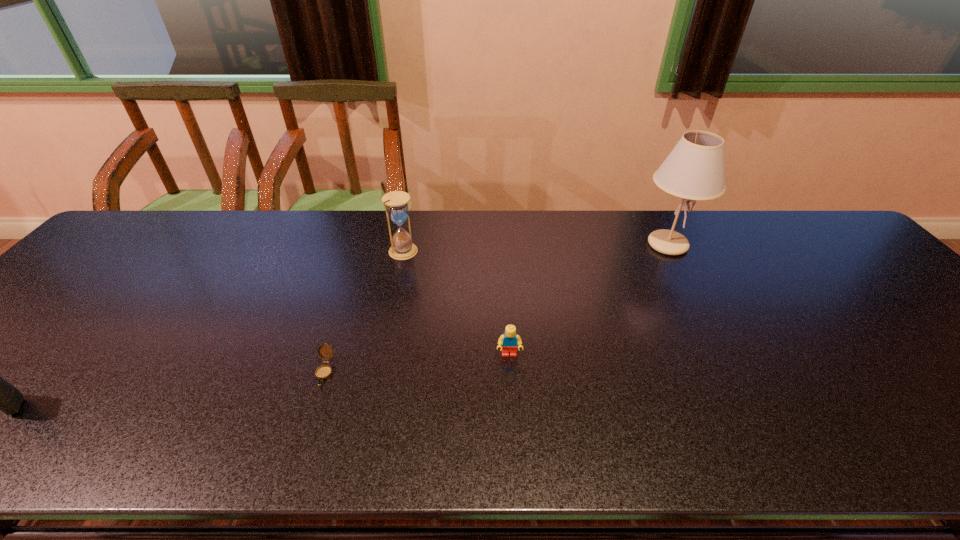
Where is `empty location between the hourglass and the tallest object`? Image resolution: width=960 pixels, height=540 pixels. empty location between the hourglass and the tallest object is located at coordinates (536, 248).

Where is `vacant area that lies between the second shortest object and the tallest object`? vacant area that lies between the second shortest object and the tallest object is located at coordinates (588, 300).

I want to click on vacant point located between the tallest object and the Lego, so click(588, 300).

The image size is (960, 540). In order to click on vacant area between the third object from right to left and the lampshade in this screenshot , I will do `click(536, 248)`.

At what (x,y) coordinates should I click in order to perform the action: click on free space between the third object from left to right and the fourth object from right to left. Please return your answer as a coordinate pair (x, y). Looking at the image, I should click on (364, 311).

Identify the location of vacant space in between the third object from right to left and the rightmost object. (536, 248).

Locate which object is the third closest to the fourth object from left to right. Please provide its 2D coordinates. Your answer should be formatted as a tuple, i.e. [(x, y)], where the tuple contains the x and y coordinates of a point satisfying the conditions above.

[(694, 170)]

This screenshot has height=540, width=960. Find the location of `the closest object relative to the third shortest object`. the closest object relative to the third shortest object is located at coordinates (323, 372).

Identify the location of free space in the image that satisfies the following two spatial constraints: 1. on the back side of the hourglass; 2. on the right side of the lampshade. (404, 245).